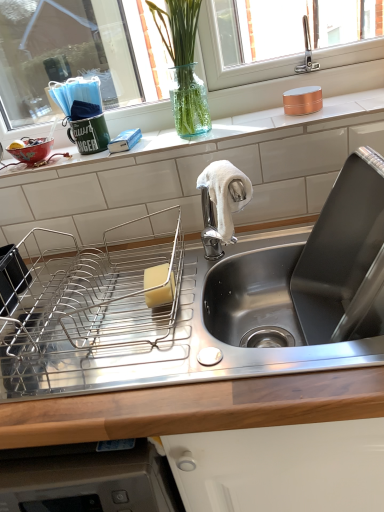
Question: In terms of width, does transparent glass vase at upper center look wider or thinner when compared to stainless steel sink at upper right?

Choices:
 (A) thin
 (B) wide

Answer: (A)

Question: Considering their positions, is transparent glass vase at upper center located in front of or behind stainless steel sink at upper right?

Choices:
 (A) front
 (B) behind

Answer: (B)

Question: Estimate the real-world distances between objects in this image. Which object is closer to the clear glass vase at upper center?

Choices:
 (A) white soft towel at center
 (B) stainless steel sink at upper right
 (C) metallic wire dish rack at center-left, the second appliance when ordered from right to left
 (D) transparent glass vase at upper center
 (E) yellow sponge at sink

Answer: (D)

Question: Which of these objects is positioned closest to the white soft towel at center?

Choices:
 (A) matte ceramic bowl at left
 (B) yellow sponge at sink
 (C) copper metallic canister at upper right, the second appliance from the bottom
 (D) metallic wire dish rack at center-left, the second appliance when ordered from right to left
 (E) white tile at upper center

Answer: (B)